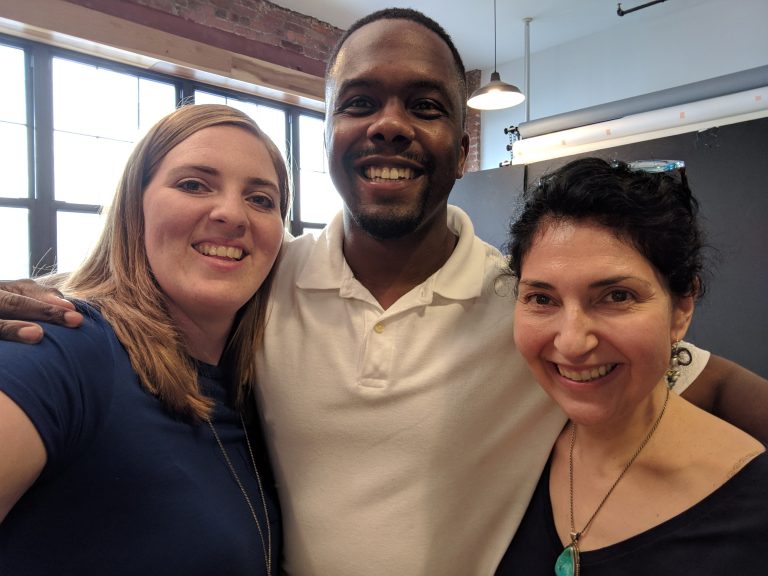
Find the location of a particular element. This screenshot has width=768, height=576. edge of frame on right wall is located at coordinates (621, 10).